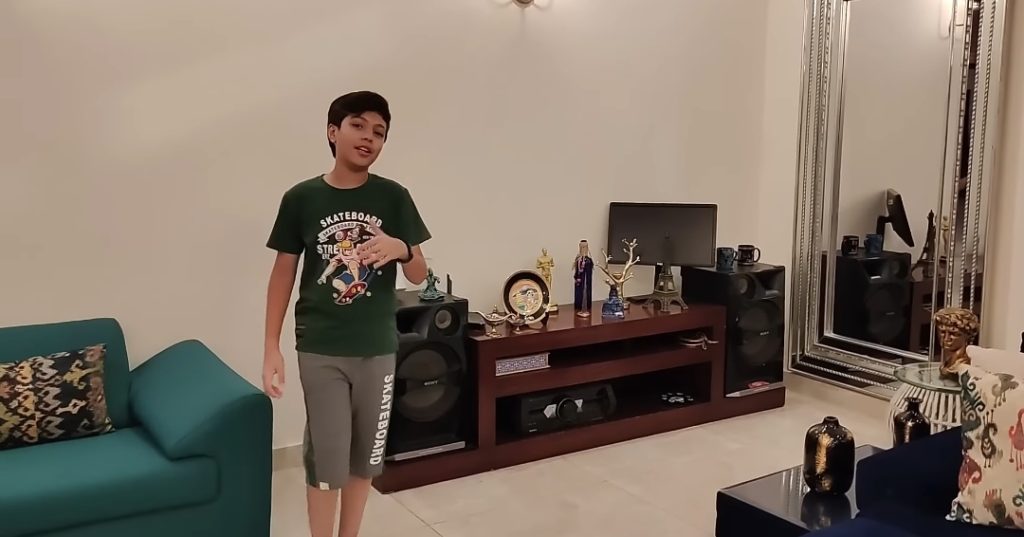
The width and height of the screenshot is (1024, 537). In order to click on deer head in this screenshot , I will do `click(609, 295)`.